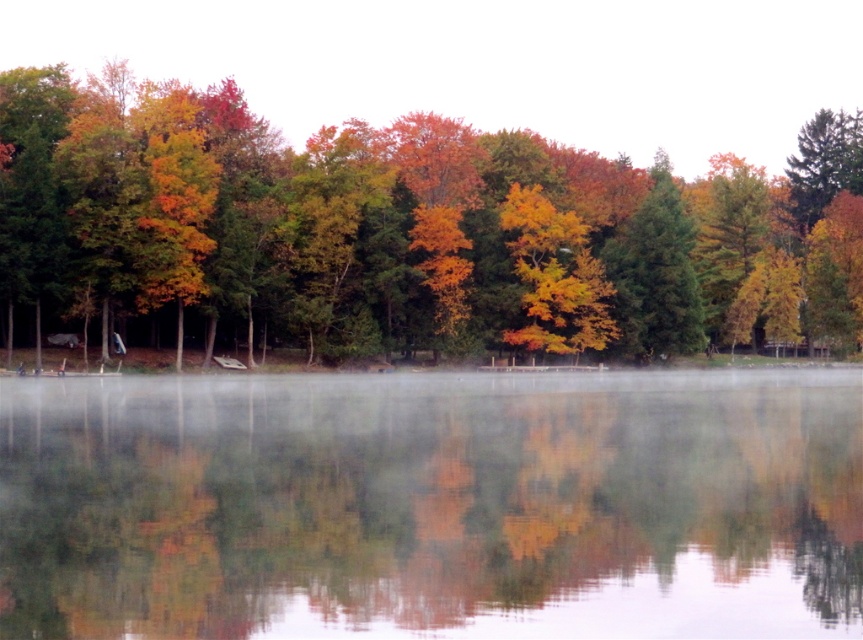
Question: Which object is the farthest from the green matte tree at center?

Choices:
 (A) autumn leaves at center
 (B) transparent misty water at center

Answer: (B)

Question: Which point appears closest to the camera in this image?

Choices:
 (A) (306, 438)
 (B) (621, 294)
 (C) (32, 113)

Answer: (A)

Question: Can you confirm if transparent misty water at center is positioned to the left of autumn leaves at center?

Choices:
 (A) no
 (B) yes

Answer: (B)

Question: Which object is positioned closest to the green matte tree at center?

Choices:
 (A) transparent misty water at center
 (B) autumn leaves at center

Answer: (B)

Question: Is transparent misty water at center positioned in front of green matte tree at center?

Choices:
 (A) no
 (B) yes

Answer: (B)

Question: In this image, where is transparent misty water at center located relative to autumn leaves at center?

Choices:
 (A) right
 (B) left

Answer: (B)